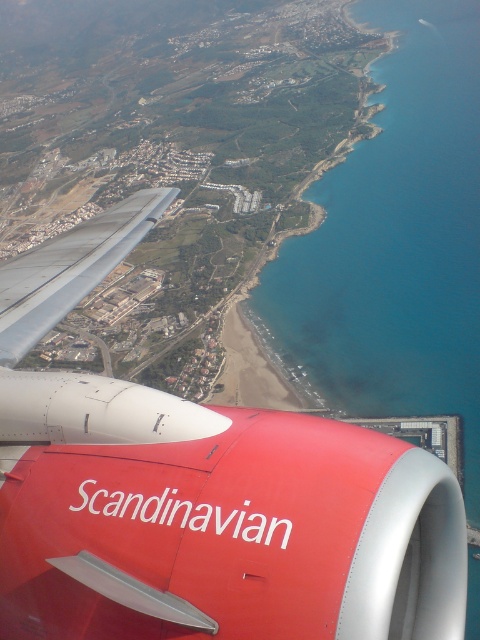
Question: Is red matte airplane engine at lower left to the right of silver metallic wing at center-left from the viewer's perspective?

Choices:
 (A) no
 (B) yes

Answer: (B)

Question: Can you confirm if red matte airplane engine at lower left is positioned to the left of blue water at lower center?

Choices:
 (A) yes
 (B) no

Answer: (A)

Question: Does red matte airplane engine at lower left have a lesser width compared to silver metallic wing at center-left?

Choices:
 (A) yes
 (B) no

Answer: (A)

Question: Which point is closer to the camera?

Choices:
 (A) silver metallic wing at center-left
 (B) red matte airplane engine at lower left
 (C) blue water at lower center

Answer: (B)

Question: Among these points, which one is nearest to the camera?

Choices:
 (A) (61, 595)
 (B) (396, 336)
 (C) (17, 340)

Answer: (A)

Question: Which point is closer to the camera?

Choices:
 (A) (168, 595)
 (B) (10, 317)

Answer: (A)